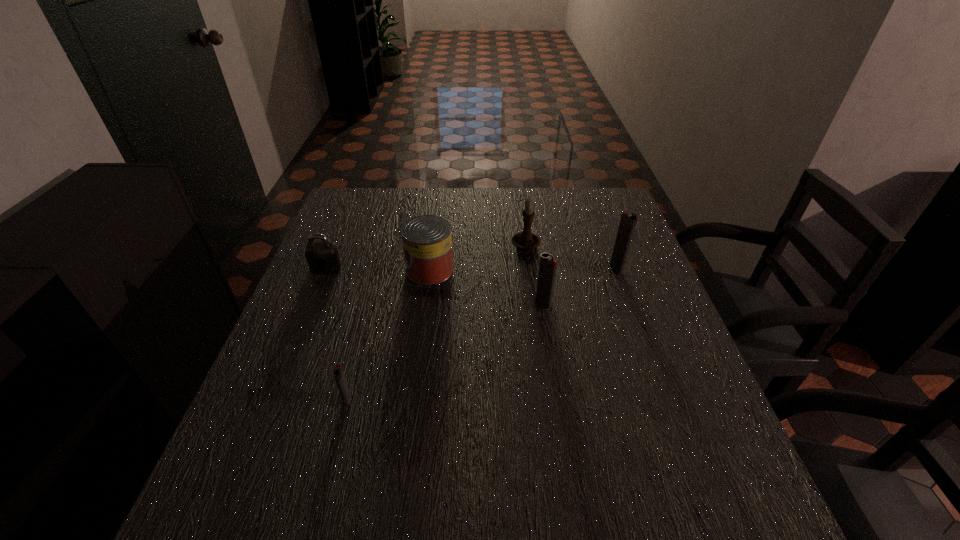
Where is `vacant area that lies between the farthest igniter and the fifth object from right to left`? vacant area that lies between the farthest igniter and the fifth object from right to left is located at coordinates (482, 334).

You are a GUI agent. You are given a task and a screenshot of the screen. Output one action in this format:
    pyautogui.click(x=<x>, y=<y>)
    Task: Click on the free spot between the leftmost igniter and the candle holder
    
    Given the screenshot: What is the action you would take?
    pyautogui.click(x=437, y=323)

Identify the location of blank region between the second tallest igniter and the nearest object. The width and height of the screenshot is (960, 540). (445, 352).

This screenshot has height=540, width=960. Identify the location of the second closest object to the rightmost object. (548, 265).

Where is `object that is the second closest to the can`? The image size is (960, 540). object that is the second closest to the can is located at coordinates (322, 257).

The image size is (960, 540). What are the coordinates of `igniter that can be found as the closest to the can` in the screenshot? It's located at point(548,265).

This screenshot has height=540, width=960. I want to click on the third closest igniter to the candle holder, so click(x=338, y=372).

This screenshot has height=540, width=960. I want to click on free space that satisfies the following two spatial constraints: 1. at the front of the can near the keyhole; 2. on the left side of the leftmost object, so click(x=325, y=270).

Image resolution: width=960 pixels, height=540 pixels. In order to click on free location that satisfies the following two spatial constraints: 1. at the front of the second tallest igniter near the keyhole; 2. on the left side of the leftmost object in this screenshot , I will do `click(311, 304)`.

Find the location of `free space that satisfies the following two spatial constraints: 1. at the front of the padlock near the keyhole; 2. on the right side of the shortest igniter`. free space that satisfies the following two spatial constraints: 1. at the front of the padlock near the keyhole; 2. on the right side of the shortest igniter is located at coordinates (272, 400).